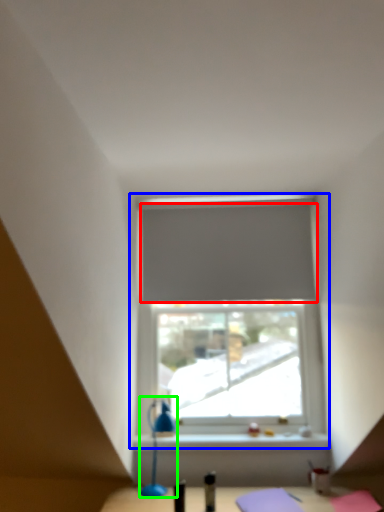
Question: Considering the real-world distances, which object is farthest from curtain (highlighted by a red box)? window (highlighted by a blue box) or table lamp (highlighted by a green box)?

Choices:
 (A) window
 (B) table lamp

Answer: (B)